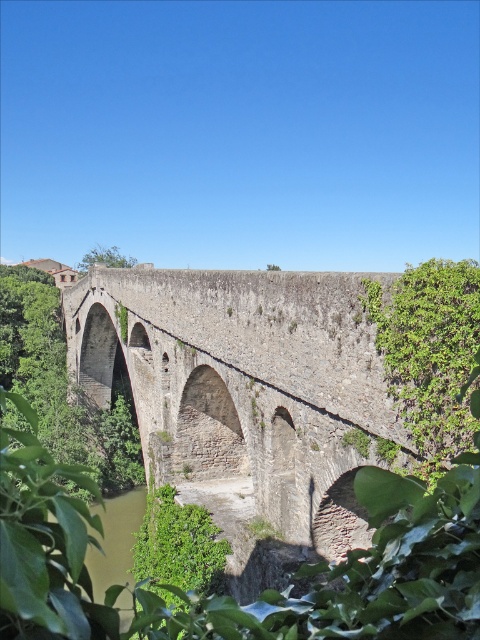
Between green leafy plant at right and green leafy vegetation at lower left, which one is positioned lower?

Positioned lower is green leafy vegetation at lower left.

Does green leafy plant at right appear over green leafy vegetation at lower left?

Indeed, green leafy plant at right is positioned over green leafy vegetation at lower left.

Between point (399, 340) and point (184, 544), which one is positioned in front?

Positioned in front is point (399, 340).

Locate an element on the screen. This screenshot has height=640, width=480. green leafy plant at right is located at coordinates (430, 353).

Is green leafy vegetation at center wider than green leafy vegetation at lower left?

Correct, the width of green leafy vegetation at center exceeds that of green leafy vegetation at lower left.

Is point (12, 609) closer to viewer compared to point (206, 531)?

Yes, point (12, 609) is in front of point (206, 531).

Describe the element at coordinates (280, 449) in the screenshot. I see `green leafy vegetation at center` at that location.

Locate an element on the screen. green leafy vegetation at center is located at coordinates (280, 449).

Based on the photo, between green leafy vegetation at center and green leafy plant at right, which one appears on the right side from the viewer's perspective?

green leafy plant at right

Between green leafy vegetation at center and green leafy plant at right, which one has less height?

With less height is green leafy plant at right.

Who is more forward, [262,422] or [411,314]?

A: Point [411,314] is in front.

Identify the location of green leafy vegetation at center. click(280, 449).